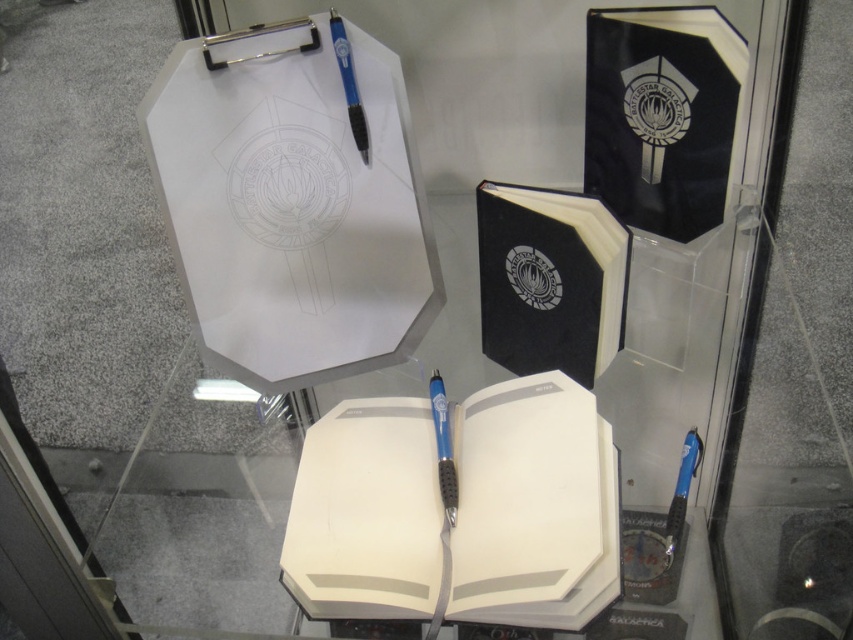
Does white matte notebook at center have a lesser height compared to blue plastic pen at upper center?

Incorrect, white matte notebook at center's height does not fall short of blue plastic pen at upper center's.

Does point (421, 580) lie behind point (346, 68)?

No, it is in front of (346, 68).

This screenshot has height=640, width=853. In order to click on white matte notebook at center in this screenshot , I will do `click(457, 509)`.

Which of these two, blue plastic pen at upper center or blue plastic pen at lower right, stands taller?

Standing taller between the two is blue plastic pen at lower right.

Does blue plastic pen at upper center appear on the left side of blue plastic pen at lower right?

Indeed, blue plastic pen at upper center is positioned on the left side of blue plastic pen at lower right.

Between point (341, 29) and point (692, 442), which one is positioned in front?

Point (341, 29) is more forward.

Locate an element on the screen. blue plastic pen at upper center is located at coordinates (349, 84).

Is white matte notebook at center above blue plastic pen at lower right?

Yes.

Between white matte notebook at center and blue plastic pen at lower right, which one is positioned higher?

white matte notebook at center

This screenshot has height=640, width=853. I want to click on white matte notebook at center, so click(457, 509).